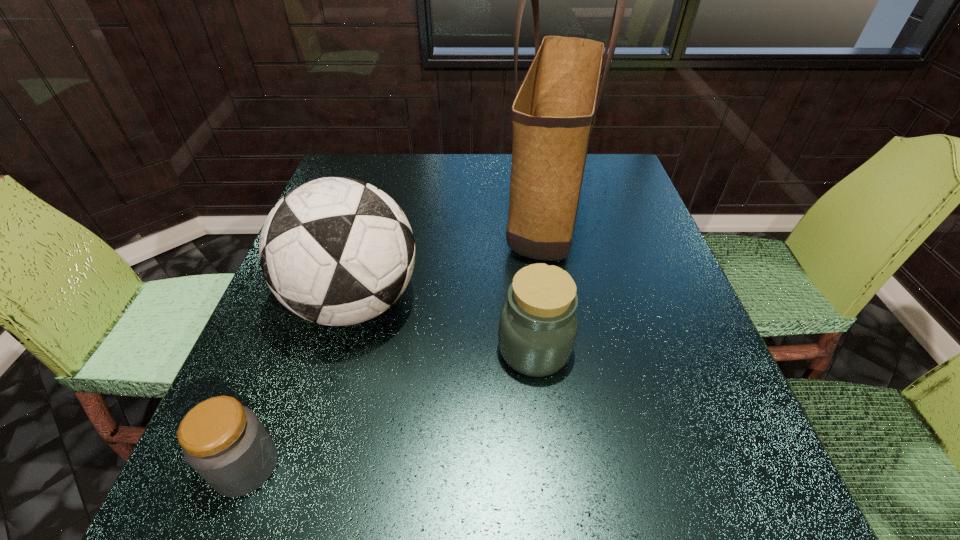
Identify the location of object present at the far edge. Image resolution: width=960 pixels, height=540 pixels. (553, 114).

Where is `object that is at the near edge`? object that is at the near edge is located at coordinates (224, 442).

Find the location of `soccer ball present at the left edge`. soccer ball present at the left edge is located at coordinates (336, 251).

At what (x,y) coordinates should I click in order to perform the action: click on jar located in the left edge section of the desktop. Please return your answer as a coordinate pair (x, y). This screenshot has width=960, height=540. Looking at the image, I should click on (224, 442).

At what (x,y) coordinates should I click in order to perform the action: click on object at the right edge. Please return your answer as a coordinate pair (x, y). The image size is (960, 540). Looking at the image, I should click on (553, 114).

The image size is (960, 540). I want to click on object that is at the near left corner, so click(224, 442).

Identify the location of object that is positioned at the far right corner. click(x=553, y=114).

Identify the location of vacant space at the far edge. The height and width of the screenshot is (540, 960). (388, 173).

The height and width of the screenshot is (540, 960). I want to click on vacant space at the right edge of the desktop, so click(x=716, y=361).

Identify the location of free location at the near left corner. (202, 522).